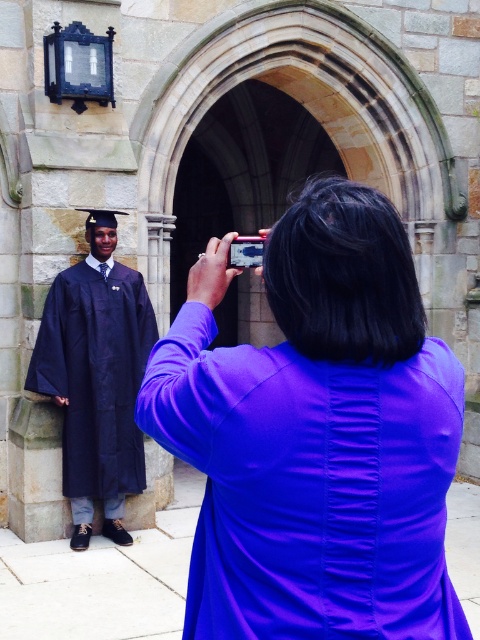
You are a photographer at the church entrance. You need to position the purple satin dress at center and the matte black gown at left so that they both fit within the frame. Given their sizes, which dress should be placed closer to the camera to ensure both are fully visible?

The purple satin dress at center, which occupies less space than the matte black gown at left, should be placed closer to the camera. This adjustment ensures that both dresses are fully visible within the frame, as the smaller dress can be positioned nearer to compensate for its size difference compared to the larger gown.

From the picture: You are standing at the point marked by the coordinates (315, 435). Looking towards the archway, can you see the black lantern on the left wall?

The purple satin dress at center is represented by point (315, 435). Since the dress is at the center and the black lantern is on the left wall, the dress might block your view of the lantern. However, without knowing the exact positions and sizes, it is uncertain. The answer cannot be definitively determined with the given information.

You are a photographer standing in front of the stone archway. You see a purple satin dress at center and a matte black gown at left. Which clothing item is closer to you?

The purple satin dress at center is closer to you because it is in front of the matte black gown at left.